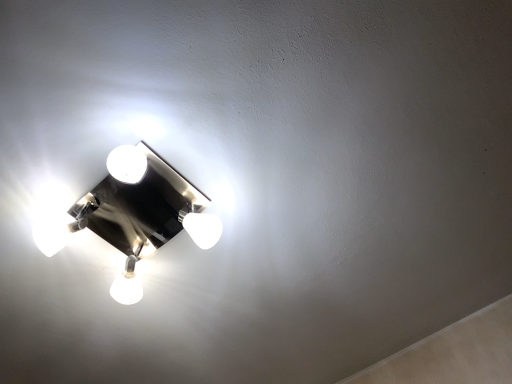
What is the approximate height of metallic silver light fixture at upper left?

metallic silver light fixture at upper left is 12.98 centimeters in height.

The width and height of the screenshot is (512, 384). Describe the element at coordinates (135, 214) in the screenshot. I see `metallic silver light fixture at upper left` at that location.

Locate an element on the screen. metallic silver light fixture at upper left is located at coordinates (135, 214).

Where is `metallic silver light fixture at upper left`? metallic silver light fixture at upper left is located at coordinates (135, 214).